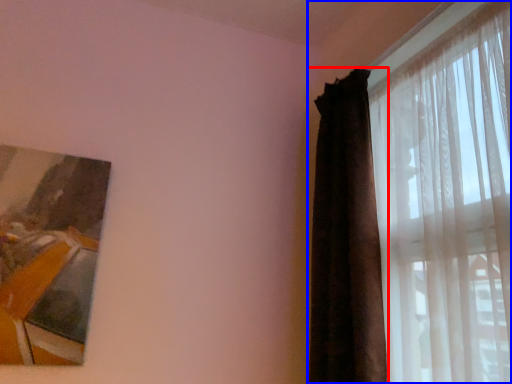
Question: Among these objects, which one is farthest to the camera, curtain (highlighted by a red box) or curtain (highlighted by a blue box)?

Choices:
 (A) curtain
 (B) curtain

Answer: (A)